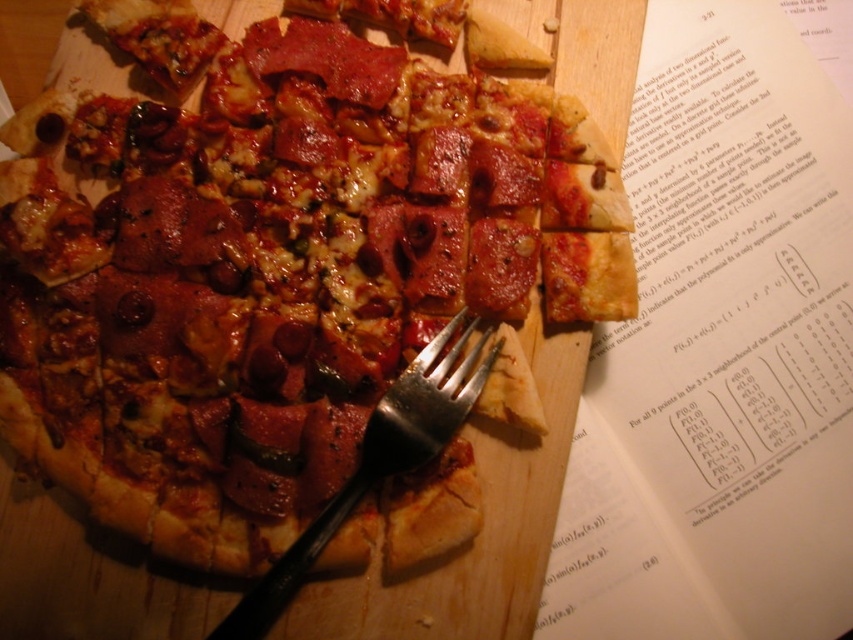
You are a person trying to pick up the matte pizza slice at upper right with the silver metallic fork at center. Can you reach the pizza slice with the fork without moving either of them?

The matte pizza slice at upper right is further to the viewer than the silver metallic fork at center, so the fork is closer to you than the pizza slice. Therefore, you cannot reach the pizza slice with the fork without moving either of them.

You are looking at the partially eaten pizza on the cutting board. There are two points marked on the pizza surface. Which point, point 1 at coordinates (271,513) or point 2 at coordinates (605,621), is closer to you?

Point 1 at coordinates (271,513) is closer to the viewer than point 2 at coordinates (605,621).